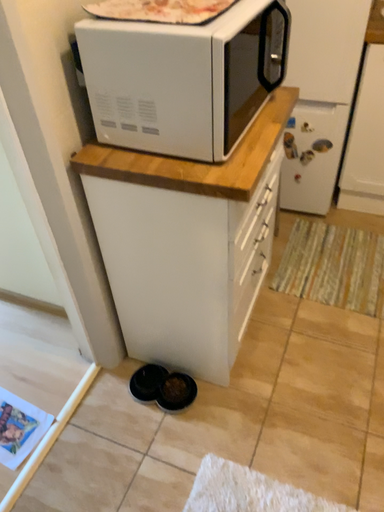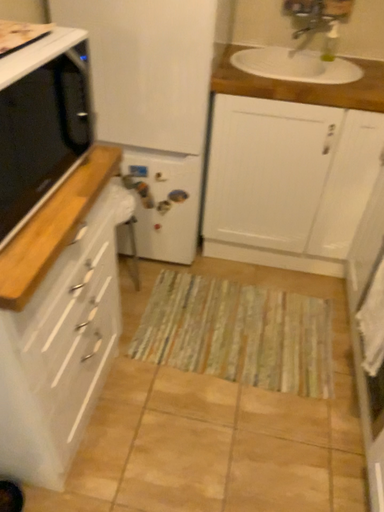
Question: How did the camera likely rotate when shooting the video?

Choices:
 (A) rotated right
 (B) rotated left

Answer: (A)